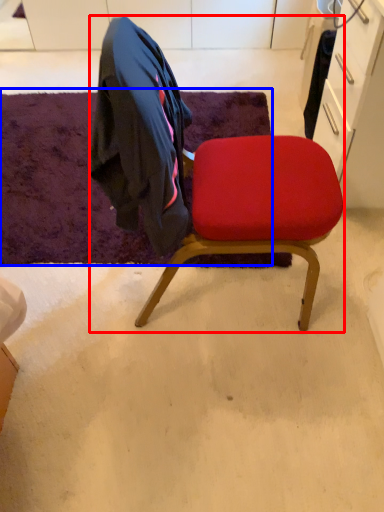
Question: Which point is closer to the camera, chair (highlighted by a red box) or mat (highlighted by a blue box)?

Choices:
 (A) chair
 (B) mat

Answer: (A)